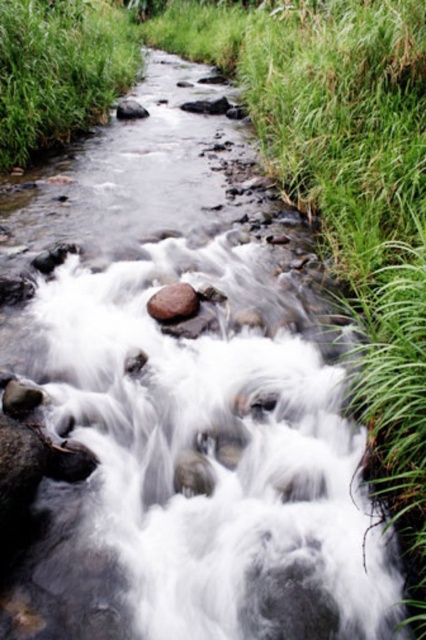
Does smooth brown rock at center appear on the right side of smooth gray rock at center?

Correct, you'll find smooth brown rock at center to the right of smooth gray rock at center.

This screenshot has width=426, height=640. I want to click on smooth brown rock at center, so click(x=173, y=301).